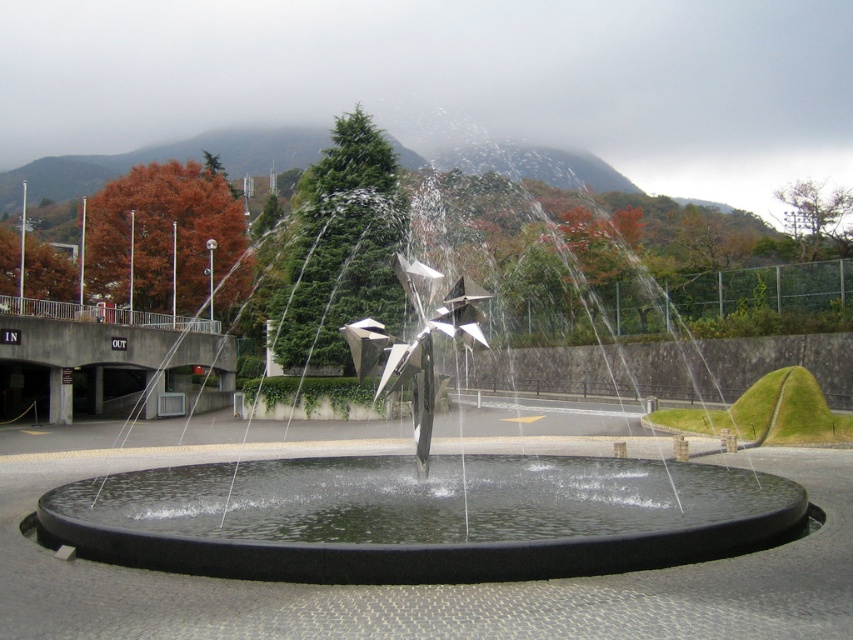
You are standing at the entrance of the park, which is located at coordinate point 0.0, 0.0. You want to visit the polished metal fountain at center. What direction should you walk to reach it?

The polished metal fountain at center is located at coordinate point (421, 515), so you should walk in the positive x and positive y direction to reach it.

You are a maintenance worker tasked with cleaning the fountain. You need to know which object has a greater width between the polished metal fountain at center and the black polished water at center. Which one is wider?

The polished metal fountain at center is wider than the black polished water at center, as its width surpasses that of the water.